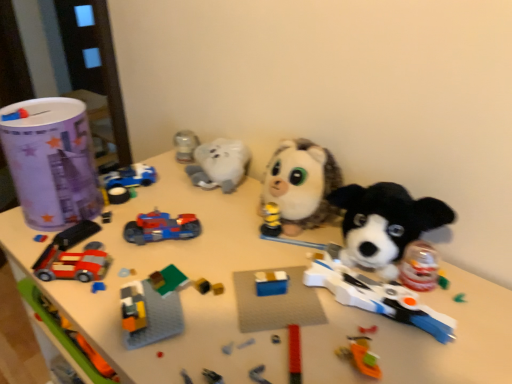
Question: Should I look upward or downward to see white matte table at center?

Choices:
 (A) down
 (B) up

Answer: (A)

Question: From the image's perspective, is white matte table at center over paper cup at left, the 1th toy viewed from the left?

Choices:
 (A) yes
 (B) no

Answer: (B)

Question: Can you confirm if white matte table at center is smaller than paper cup at left, marked as the fifth toy in a right-to-left arrangement?

Choices:
 (A) yes
 (B) no

Answer: (B)

Question: Is white matte table at center aimed at paper cup at left, marked as the fifth toy in a right-to-left arrangement?

Choices:
 (A) no
 (B) yes

Answer: (A)

Question: Is white matte table at center not within paper cup at left, marked as the fifth toy in a right-to-left arrangement?

Choices:
 (A) no
 (B) yes

Answer: (B)

Question: Is paper cup at left, the 1th toy viewed from the left, inside white matte table at center?

Choices:
 (A) yes
 (B) no

Answer: (B)

Question: Considering the relative positions of white matte table at center and paper cup at left, the 1th toy viewed from the left, in the image provided, is white matte table at center behind paper cup at left, the 1th toy viewed from the left,?

Choices:
 (A) no
 (B) yes

Answer: (A)

Question: Does blue plastic car at upper left, positioned as the third toy in right-to-left order, have a greater height compared to paper cup at left, the 1th toy viewed from the left?

Choices:
 (A) no
 (B) yes

Answer: (A)

Question: Is blue plastic car at upper left, positioned as the 3th toy in left-to-right order, behind paper cup at left, the 1th toy viewed from the left?

Choices:
 (A) no
 (B) yes

Answer: (B)

Question: From a real-world perspective, is blue plastic car at upper left, positioned as the third toy in right-to-left order, on paper cup at left, marked as the fifth toy in a right-to-left arrangement?

Choices:
 (A) yes
 (B) no

Answer: (B)

Question: From the image's perspective, is blue plastic car at upper left, positioned as the 3th toy in left-to-right order, above paper cup at left, marked as the fifth toy in a right-to-left arrangement?

Choices:
 (A) yes
 (B) no

Answer: (B)

Question: Considering the relative sizes of blue plastic car at upper left, positioned as the third toy in right-to-left order, and paper cup at left, the 1th toy viewed from the left, in the image provided, is blue plastic car at upper left, positioned as the third toy in right-to-left order, bigger than paper cup at left, the 1th toy viewed from the left,?

Choices:
 (A) no
 (B) yes

Answer: (A)

Question: Does blue plastic car at upper left, positioned as the 3th toy in left-to-right order, have a greater width compared to paper cup at left, marked as the fifth toy in a right-to-left arrangement?

Choices:
 (A) no
 (B) yes

Answer: (A)

Question: From a real-world perspective, is paper cup at left, the 1th toy viewed from the left, physically below shiny plastic toy car at center, the fourth toy positioned from the left?

Choices:
 (A) yes
 (B) no

Answer: (B)